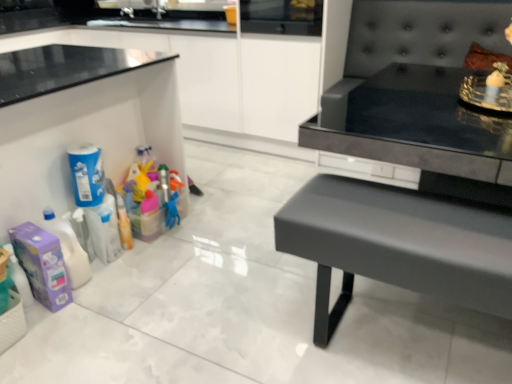
Question: From a real-world perspective, is blue matte cleaning product at left, which ranks as the 2th cleaning product in bottom-to-top order, located beneath white woven basket at lower left?

Choices:
 (A) yes
 (B) no

Answer: (B)

Question: Does blue matte cleaning product at left, which appears as the 1th cleaning product when viewed from the top, contain white woven basket at lower left?

Choices:
 (A) yes
 (B) no

Answer: (B)

Question: Does blue matte cleaning product at left, which appears as the 1th cleaning product when viewed from the top, have a lesser height compared to white woven basket at lower left?

Choices:
 (A) yes
 (B) no

Answer: (B)

Question: Considering the relative positions of blue matte cleaning product at left, which ranks as the 2th cleaning product in bottom-to-top order, and white woven basket at lower left in the image provided, is blue matte cleaning product at left, which ranks as the 2th cleaning product in bottom-to-top order, to the right of white woven basket at lower left from the viewer's perspective?

Choices:
 (A) no
 (B) yes

Answer: (B)

Question: Is the depth of blue matte cleaning product at left, which appears as the 1th cleaning product when viewed from the top, less than that of white woven basket at lower left?

Choices:
 (A) yes
 (B) no

Answer: (B)

Question: Is blue matte cleaning product at left, which appears as the 1th cleaning product when viewed from the top, aimed at white woven basket at lower left?

Choices:
 (A) yes
 (B) no

Answer: (B)

Question: Is white woven basket at lower left smaller than blue matte cleaning product at left, which appears as the 1th cleaning product when viewed from the top?

Choices:
 (A) yes
 (B) no

Answer: (A)

Question: Is white woven basket at lower left positioned before blue matte cleaning product at left, which ranks as the 2th cleaning product in bottom-to-top order?

Choices:
 (A) no
 (B) yes

Answer: (B)

Question: Can we say white woven basket at lower left lies outside blue matte cleaning product at left, which ranks as the 2th cleaning product in bottom-to-top order?

Choices:
 (A) no
 (B) yes

Answer: (B)

Question: Can you confirm if white woven basket at lower left is bigger than blue matte cleaning product at left, which appears as the 1th cleaning product when viewed from the top?

Choices:
 (A) no
 (B) yes

Answer: (A)

Question: Can you confirm if white woven basket at lower left is positioned to the left of blue matte cleaning product at left, which appears as the 1th cleaning product when viewed from the top?

Choices:
 (A) no
 (B) yes

Answer: (B)

Question: Considering the relative sizes of white woven basket at lower left and blue matte cleaning product at left, which appears as the 1th cleaning product when viewed from the top, in the image provided, is white woven basket at lower left taller than blue matte cleaning product at left, which appears as the 1th cleaning product when viewed from the top,?

Choices:
 (A) yes
 (B) no

Answer: (B)

Question: Is purple cardboard box at lower left, which is the 1th cleaning product from bottom to top, next to blue matte cleaning product at left, which ranks as the 2th cleaning product in bottom-to-top order, and touching it?

Choices:
 (A) yes
 (B) no

Answer: (B)